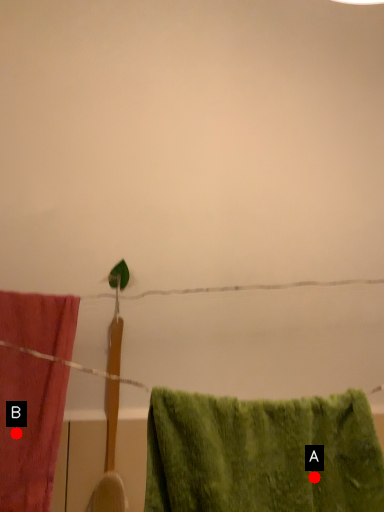
Question: Two points are circled on the image, labeled by A and B beside each circle. Which point is farther from the camera taking this photo?

Choices:
 (A) A is further
 (B) B is further

Answer: (B)